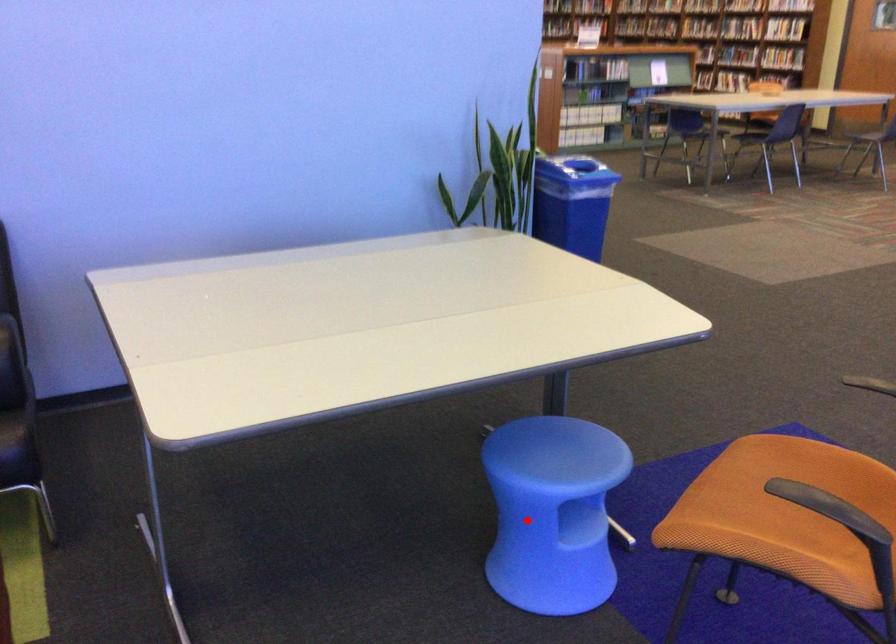
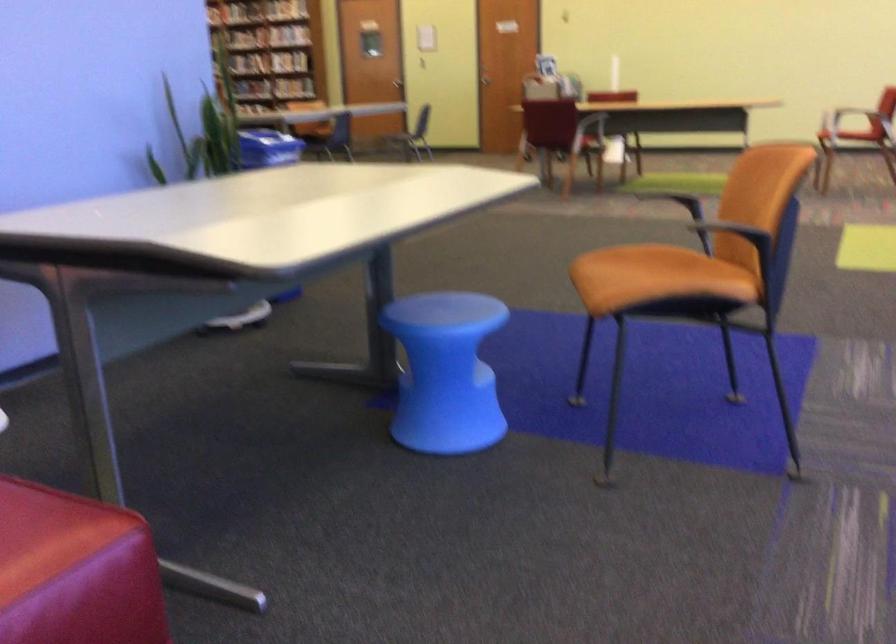
Where in the second image is the point corresponding to the highlighted location from the first image?

(445, 372)